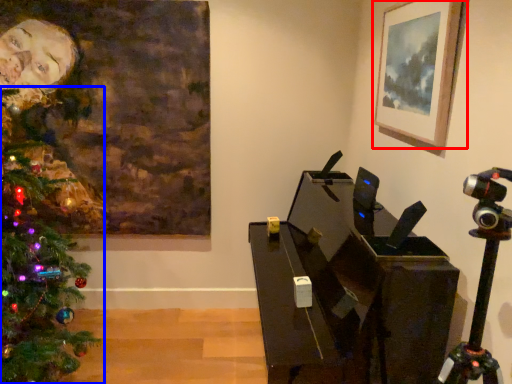
Question: Among these objects, which one is farthest to the camera, picture frame (highlighted by a red box) or christmas tree (highlighted by a blue box)?

Choices:
 (A) picture frame
 (B) christmas tree

Answer: (A)